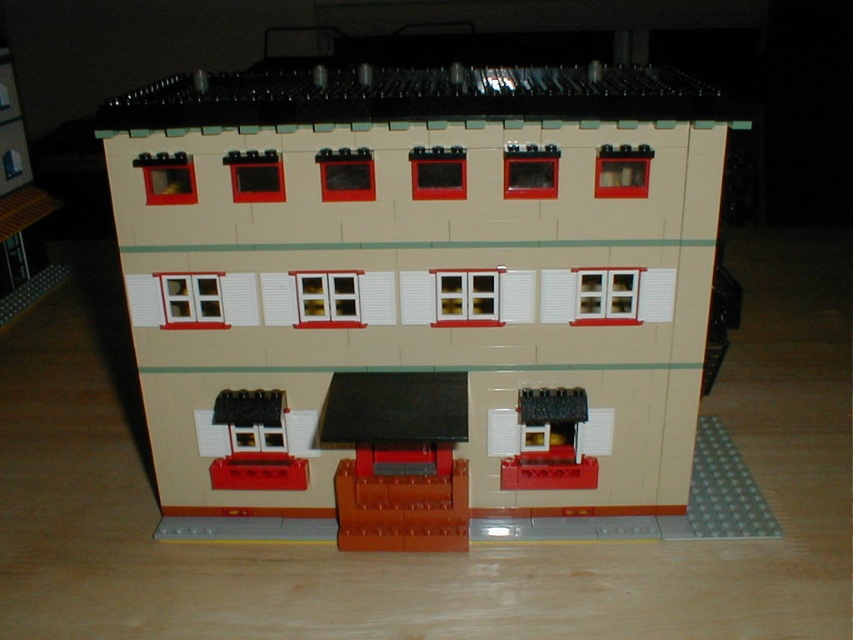
You are standing in front of the LEGO model and want to place a small LEGO figure on the awning. Can you place the figure on the matte black awning at center without it being on top of the beige matte building at center?

The beige matte building at center is located above the matte black awning at center, so you can place the small LEGO figure on the matte black awning at center without it being on top of the beige matte building at center.